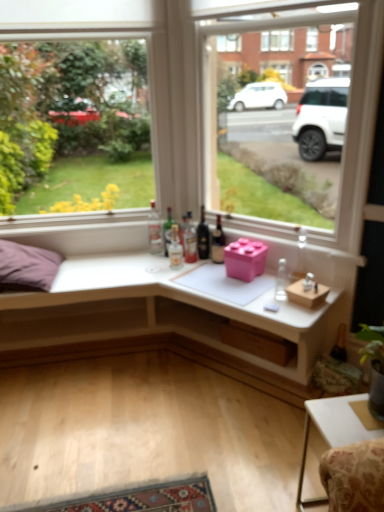
You are a GUI agent. You are given a task and a screenshot of the screen. Output one action in this format:
    pyautogui.click(x=<x>, y=<y>)
    Task: Click on the vacant space in front of translucent glass bottle at center, acting as the fourth bottle starting from the left
    The image size is (384, 512).
    Given the screenshot: What is the action you would take?
    pyautogui.click(x=191, y=274)